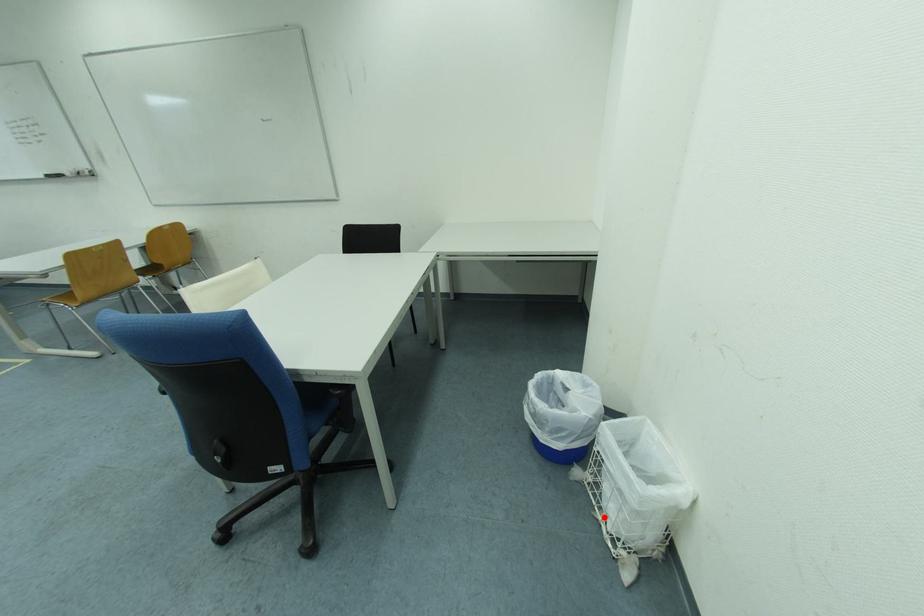
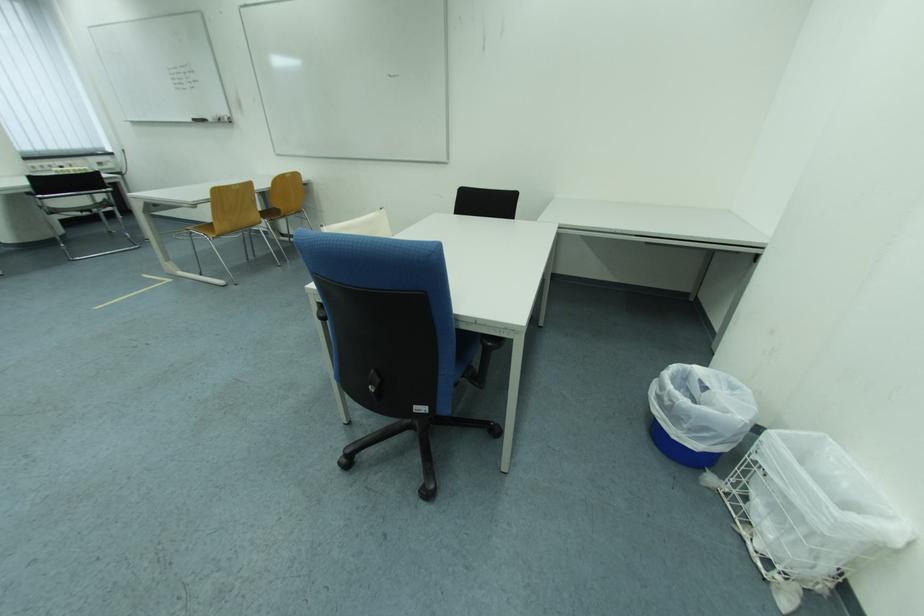
The point at the highlighted location is marked in the first image. Where is the corresponding point in the second image?

(745, 532)